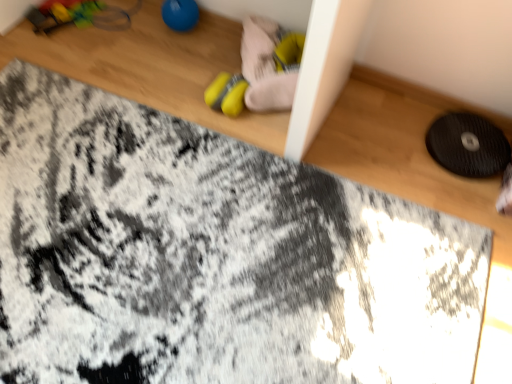
What is the approximate width of yellow rubber toy at center, arranged as the first toy when viewed from the right?

yellow rubber toy at center, arranged as the first toy when viewed from the right, is 22.61 centimeters wide.

In order to face yellow fabric shoe at upper center, should I rotate leftwards or rightwards?

Rotate left and turn 3.071 degrees.

Find the location of a particular element. This screenshot has width=512, height=384. yellow rubber toy at center, the 2th toy in the left-to-right sequence is located at coordinates pyautogui.click(x=265, y=66).

Considering the relative sizes of yellow rubber toy at center, the 2th toy in the left-to-right sequence, and black textured mat at right in the image provided, is yellow rubber toy at center, the 2th toy in the left-to-right sequence, bigger than black textured mat at right?

Yes, yellow rubber toy at center, the 2th toy in the left-to-right sequence, is bigger than black textured mat at right.

Which is correct: yellow rubber toy at center, the 2th toy in the left-to-right sequence, is inside black textured mat at right, or outside of it?

yellow rubber toy at center, the 2th toy in the left-to-right sequence, cannot be found inside black textured mat at right.

Is yellow rubber toy at center, the 2th toy in the left-to-right sequence, to the right of black textured mat at right from the viewer's perspective?

No, yellow rubber toy at center, the 2th toy in the left-to-right sequence, is not to the right of black textured mat at right.

Is yellow rubber toy at center, the 2th toy in the left-to-right sequence, far from black textured mat at right?

yellow rubber toy at center, the 2th toy in the left-to-right sequence, is near black textured mat at right, not far away.

Image resolution: width=512 pixels, height=384 pixels. Find the location of `footwear located above the black textured mat at right (from a real-world perspective)`. footwear located above the black textured mat at right (from a real-world perspective) is located at coordinates (226, 94).

Considering the relative sizes of black textured mat at right and yellow fabric shoe at upper center in the image provided, is black textured mat at right taller than yellow fabric shoe at upper center?

Correct, black textured mat at right is much taller as yellow fabric shoe at upper center.

Considering the sizes of objects black textured mat at right and yellow fabric shoe at upper center in the image provided, who is bigger, black textured mat at right or yellow fabric shoe at upper center?

With larger size is black textured mat at right.

From a real-world perspective, is yellow rubber toy at center, arranged as the first toy when viewed from the right, under blue rubber ball at upper center, arranged as the 2th toy when viewed from the right?

Incorrect, from a real-world perspective, yellow rubber toy at center, arranged as the first toy when viewed from the right, is higher than blue rubber ball at upper center, arranged as the 2th toy when viewed from the right.

Between yellow rubber toy at center, the 2th toy in the left-to-right sequence, and blue rubber ball at upper center, arranged as the 2th toy when viewed from the right, which one has larger width?

With larger width is yellow rubber toy at center, the 2th toy in the left-to-right sequence.

From the image's perspective, who appears lower, yellow rubber toy at center, the 2th toy in the left-to-right sequence, or blue rubber ball at upper center, the first toy in the left-to-right sequence?

yellow rubber toy at center, the 2th toy in the left-to-right sequence, is shown below in the image.

Considering the relative positions of yellow rubber toy at center, arranged as the first toy when viewed from the right, and blue rubber ball at upper center, arranged as the 2th toy when viewed from the right, in the image provided, is yellow rubber toy at center, arranged as the first toy when viewed from the right, to the left of blue rubber ball at upper center, arranged as the 2th toy when viewed from the right, from the viewer's perspective?

In fact, yellow rubber toy at center, arranged as the first toy when viewed from the right, is to the right of blue rubber ball at upper center, arranged as the 2th toy when viewed from the right.

Is black textured mat at right at the left side of blue rubber ball at upper center, the first toy in the left-to-right sequence?

In fact, black textured mat at right is to the right of blue rubber ball at upper center, the first toy in the left-to-right sequence.

Considering the relative sizes of black textured mat at right and blue rubber ball at upper center, the first toy in the left-to-right sequence, in the image provided, is black textured mat at right taller than blue rubber ball at upper center, the first toy in the left-to-right sequence,?

In fact, black textured mat at right may be shorter than blue rubber ball at upper center, the first toy in the left-to-right sequence.

Is black textured mat at right smaller than blue rubber ball at upper center, the first toy in the left-to-right sequence?

Incorrect, black textured mat at right is not smaller in size than blue rubber ball at upper center, the first toy in the left-to-right sequence.

Is black textured mat at right oriented away from blue rubber ball at upper center, arranged as the 2th toy when viewed from the right?

No.

Based on their sizes in the image, would you say blue rubber ball at upper center, the first toy in the left-to-right sequence, is bigger or smaller than yellow rubber toy at center, the 2th toy in the left-to-right sequence?

Considering their sizes, blue rubber ball at upper center, the first toy in the left-to-right sequence, takes up less space than yellow rubber toy at center, the 2th toy in the left-to-right sequence.

From the image's perspective, between blue rubber ball at upper center, arranged as the 2th toy when viewed from the right, and yellow rubber toy at center, arranged as the first toy when viewed from the right, who is located below?

yellow rubber toy at center, arranged as the first toy when viewed from the right, from the image's perspective.

Would you consider blue rubber ball at upper center, arranged as the 2th toy when viewed from the right, to be distant from yellow rubber toy at center, arranged as the first toy when viewed from the right?

No, there isn't a large distance between blue rubber ball at upper center, arranged as the 2th toy when viewed from the right, and yellow rubber toy at center, arranged as the first toy when viewed from the right.

What are the coordinates of `toy located in front of the blue rubber ball at upper center, arranged as the 2th toy when viewed from the right` in the screenshot? It's located at (265, 66).

Is yellow fabric shoe at upper center facing away from blue rubber ball at upper center, the first toy in the left-to-right sequence?

No, blue rubber ball at upper center, the first toy in the left-to-right sequence, is not at the back of yellow fabric shoe at upper center.

From the picture: Is yellow fabric shoe at upper center inside the boundaries of blue rubber ball at upper center, arranged as the 2th toy when viewed from the right, or outside?

yellow fabric shoe at upper center lies outside blue rubber ball at upper center, arranged as the 2th toy when viewed from the right.

Is there a large distance between yellow fabric shoe at upper center and blue rubber ball at upper center, arranged as the 2th toy when viewed from the right?

No, yellow fabric shoe at upper center is not far away from blue rubber ball at upper center, arranged as the 2th toy when viewed from the right.

Is blue rubber ball at upper center, arranged as the 2th toy when viewed from the right, outside of black textured mat at right?

Yes, blue rubber ball at upper center, arranged as the 2th toy when viewed from the right, is located beyond the bounds of black textured mat at right.

Which of these two, blue rubber ball at upper center, the first toy in the left-to-right sequence, or black textured mat at right, is smaller?

Smaller between the two is blue rubber ball at upper center, the first toy in the left-to-right sequence.

From the image's perspective, is blue rubber ball at upper center, arranged as the 2th toy when viewed from the right, over black textured mat at right?

Yes, from the image's perspective, blue rubber ball at upper center, arranged as the 2th toy when viewed from the right, is on top of black textured mat at right.

Could you tell me if blue rubber ball at upper center, arranged as the 2th toy when viewed from the right, is facing black textured mat at right?

No, blue rubber ball at upper center, arranged as the 2th toy when viewed from the right, does not turn towards black textured mat at right.

There is a black textured mat at right. In order to click on the 1st toy above it (from the image's perspective) in this screenshot , I will do `click(265, 66)`.

This screenshot has height=384, width=512. I want to click on mat that appears below the yellow fabric shoe at upper center (from the image's perspective), so click(468, 145).

Consider the image. Estimate the real-world distances between objects in this image. Which object is closer to yellow fabric shoe at upper center, blue rubber ball at upper center, the first toy in the left-to-right sequence, or yellow rubber toy at center, the 2th toy in the left-to-right sequence?

yellow rubber toy at center, the 2th toy in the left-to-right sequence, lies closer to yellow fabric shoe at upper center than the other object.

Based on the photo, considering their positions, is yellow rubber toy at center, the 2th toy in the left-to-right sequence, positioned closer to black textured mat at right than yellow fabric shoe at upper center?

Among the two, yellow rubber toy at center, the 2th toy in the left-to-right sequence, is located nearer to black textured mat at right.

From the image, which object appears to be farther from blue rubber ball at upper center, arranged as the 2th toy when viewed from the right, yellow rubber toy at center, the 2th toy in the left-to-right sequence, or black textured mat at right?

black textured mat at right is positioned further to the anchor blue rubber ball at upper center, arranged as the 2th toy when viewed from the right.

Looking at the image, which one is located further to yellow rubber toy at center, arranged as the first toy when viewed from the right, blue rubber ball at upper center, the first toy in the left-to-right sequence, or yellow fabric shoe at upper center?

blue rubber ball at upper center, the first toy in the left-to-right sequence, is positioned further to the anchor yellow rubber toy at center, arranged as the first toy when viewed from the right.

Looking at the image, which one is located further to black textured mat at right, yellow rubber toy at center, the 2th toy in the left-to-right sequence, or blue rubber ball at upper center, arranged as the 2th toy when viewed from the right?

blue rubber ball at upper center, arranged as the 2th toy when viewed from the right, is positioned further to the anchor black textured mat at right.

Looking at the image, which one is located closer to yellow fabric shoe at upper center, black textured mat at right or blue rubber ball at upper center, the first toy in the left-to-right sequence?

The object closer to yellow fabric shoe at upper center is blue rubber ball at upper center, the first toy in the left-to-right sequence.

When comparing their distances from yellow fabric shoe at upper center, does blue rubber ball at upper center, the first toy in the left-to-right sequence, or black textured mat at right seem closer?

Among the two, blue rubber ball at upper center, the first toy in the left-to-right sequence, is located nearer to yellow fabric shoe at upper center.

Which object lies further to the anchor point blue rubber ball at upper center, arranged as the 2th toy when viewed from the right, yellow fabric shoe at upper center or black textured mat at right?

Based on the image, black textured mat at right appears to be further to blue rubber ball at upper center, arranged as the 2th toy when viewed from the right.

Locate an element on the screen. The height and width of the screenshot is (384, 512). toy between blue rubber ball at upper center, arranged as the 2th toy when viewed from the right, and yellow fabric shoe at upper center from top to bottom is located at coordinates (265, 66).

The image size is (512, 384). I want to click on toy situated between blue rubber ball at upper center, the first toy in the left-to-right sequence, and black textured mat at right from left to right, so click(265, 66).

Where is `footwear between blue rubber ball at upper center, arranged as the 2th toy when viewed from the right, and black textured mat at right, in the horizontal direction`? footwear between blue rubber ball at upper center, arranged as the 2th toy when viewed from the right, and black textured mat at right, in the horizontal direction is located at coordinates (226, 94).

You are a GUI agent. You are given a task and a screenshot of the screen. Output one action in this format:
    pyautogui.click(x=<x>, y=<y>)
    Task: Click on the toy situated between yellow fabric shoe at upper center and black textured mat at right from left to right
    The height and width of the screenshot is (384, 512).
    Given the screenshot: What is the action you would take?
    pyautogui.click(x=265, y=66)